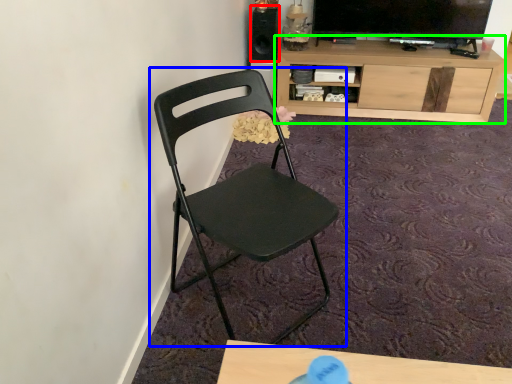
Question: Estimate the real-world distances between objects in this image. Which object is farther from speaker (highlighted by a red box), chair (highlighted by a blue box) or cabinetry (highlighted by a green box)?

Choices:
 (A) chair
 (B) cabinetry

Answer: (A)